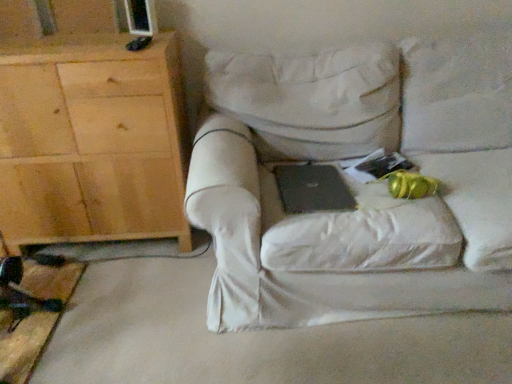
Question: Is white fabric chair at center next to black matte laptop at center?

Choices:
 (A) yes
 (B) no

Answer: (B)

Question: Can you confirm if white fabric chair at center is shorter than black matte laptop at center?

Choices:
 (A) yes
 (B) no

Answer: (B)

Question: Is white fabric chair at center taller than black matte laptop at center?

Choices:
 (A) no
 (B) yes

Answer: (B)

Question: Considering the relative sizes of white fabric chair at center and black matte laptop at center in the image provided, is white fabric chair at center wider than black matte laptop at center?

Choices:
 (A) yes
 (B) no

Answer: (A)

Question: From a real-world perspective, is white fabric chair at center on black matte laptop at center?

Choices:
 (A) no
 (B) yes

Answer: (B)

Question: From a real-world perspective, is white fabric chair at center above or below light wood cabinet at left?

Choices:
 (A) below
 (B) above

Answer: (A)

Question: Is white fabric chair at center situated inside light wood cabinet at left or outside?

Choices:
 (A) outside
 (B) inside

Answer: (A)

Question: From the image's perspective, is white fabric chair at center positioned above or below light wood cabinet at left?

Choices:
 (A) above
 (B) below

Answer: (B)

Question: Is point (387, 135) positioned closer to the camera than point (78, 182)?

Choices:
 (A) farther
 (B) closer

Answer: (A)

Question: Considering the positions of white fabric chair at center and black matte laptop at center in the image, is white fabric chair at center bigger or smaller than black matte laptop at center?

Choices:
 (A) small
 (B) big

Answer: (B)

Question: From a real-world perspective, is white fabric chair at center physically located above or below black matte laptop at center?

Choices:
 (A) above
 (B) below

Answer: (A)

Question: From their relative heights in the image, would you say white fabric chair at center is taller or shorter than black matte laptop at center?

Choices:
 (A) tall
 (B) short

Answer: (A)

Question: Considering the positions of point (432, 165) and point (276, 177), is point (432, 165) closer or farther from the camera than point (276, 177)?

Choices:
 (A) farther
 (B) closer

Answer: (A)

Question: In the image, is black matte laptop at center on the left side or the right side of light wood cabinet at left?

Choices:
 (A) right
 (B) left

Answer: (A)

Question: Is black matte laptop at center wider or thinner than light wood cabinet at left?

Choices:
 (A) thin
 (B) wide

Answer: (A)